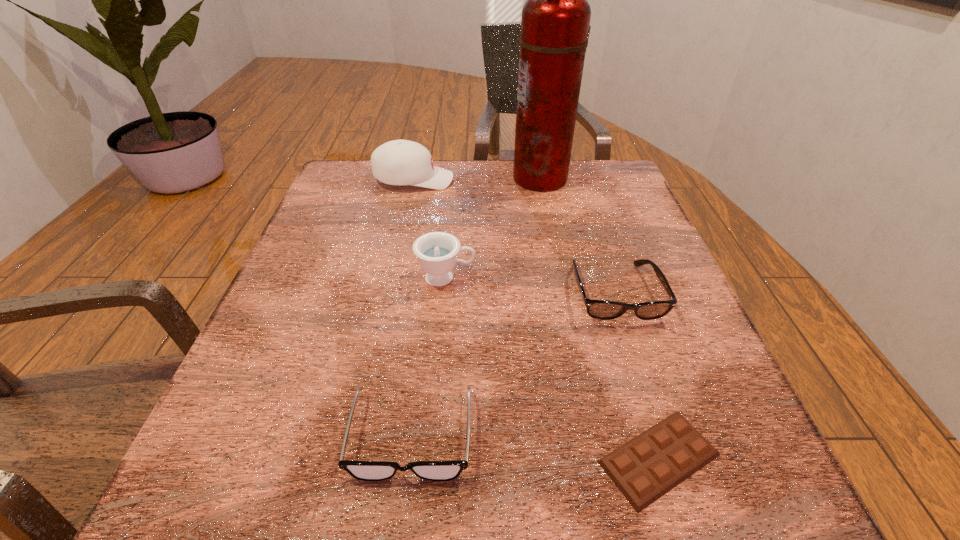
I want to click on vacant space at the right edge of the desktop, so click(682, 307).

Where is `free space at the far left corner of the desktop`? This screenshot has height=540, width=960. free space at the far left corner of the desktop is located at coordinates (358, 186).

Locate an element on the screen. Image resolution: width=960 pixels, height=540 pixels. vacant position at the near left corner of the desktop is located at coordinates (320, 460).

You are a GUI agent. You are given a task and a screenshot of the screen. Output one action in this format:
    pyautogui.click(x=<x>, y=<y>)
    Task: Click on the vacant space at the far right corner of the desktop
    The image size is (960, 540).
    Given the screenshot: What is the action you would take?
    pyautogui.click(x=607, y=172)

You are a GUI agent. You are given a task and a screenshot of the screen. Output one action in this format:
    pyautogui.click(x=<x>, y=<y>)
    Task: Click on the free space between the fifth shortest object and the teacup
    This screenshot has height=540, width=960.
    Given the screenshot: What is the action you would take?
    pyautogui.click(x=430, y=229)

I want to click on free space between the chocolate bar and the left spectacles, so click(536, 447).

At what (x,y) coordinates should I click in order to perform the action: click on free area in between the second tallest object and the fourth shortest object. Please return your answer as a coordinate pair (x, y). The height and width of the screenshot is (540, 960). Looking at the image, I should click on (430, 229).

Where is `free space between the shortest object and the nearer spectacles`? The height and width of the screenshot is (540, 960). free space between the shortest object and the nearer spectacles is located at coordinates (536, 447).

At what (x,y) coordinates should I click in order to perform the action: click on free space that is in between the fire extinguisher and the teacup. Please return your answer as a coordinate pair (x, y). The height and width of the screenshot is (540, 960). Looking at the image, I should click on (492, 228).

This screenshot has width=960, height=540. I want to click on free space between the teacup and the fire extinguisher, so click(492, 228).